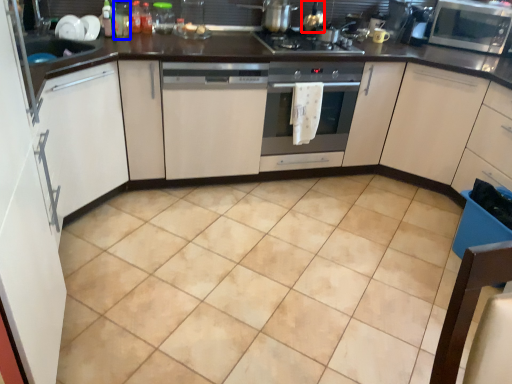
Question: Which object is closer to the camera taking this photo, appliance (highlighted by a red box) or bottle (highlighted by a blue box)?

Choices:
 (A) appliance
 (B) bottle

Answer: (B)